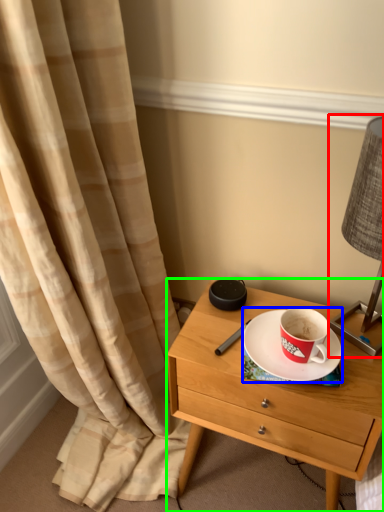
Question: Estimate the real-world distances between objects in this image. Which object is closer to bedside lamp (highlighted by a red box), saucer (highlighted by a blue box) or nightstand (highlighted by a green box)?

Choices:
 (A) saucer
 (B) nightstand

Answer: (A)